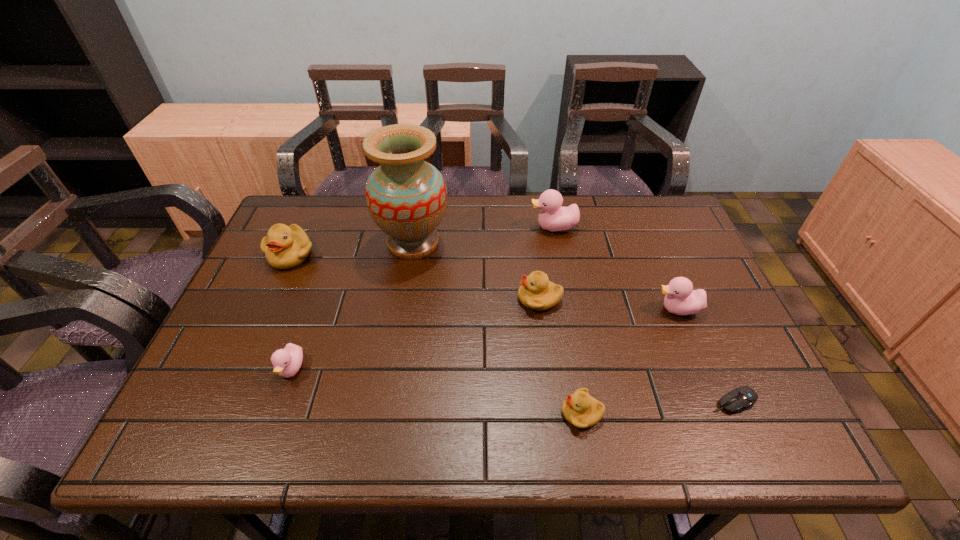
In the image, there is a desktop. At what (x,y) coordinates should I click in order to perform the action: click on vacant space at the left edge. Please return your answer as a coordinate pair (x, y). Looking at the image, I should click on (297, 303).

Locate an element on the screen. This screenshot has width=960, height=540. free location at the right edge is located at coordinates (714, 356).

This screenshot has height=540, width=960. In order to click on vacant area at the far left corner of the desktop in this screenshot , I will do `click(300, 213)`.

Where is `vacant position at the near left corner of the desktop`? The width and height of the screenshot is (960, 540). vacant position at the near left corner of the desktop is located at coordinates click(196, 436).

This screenshot has width=960, height=540. I want to click on free space between the nearest duckling and the second smallest yellow duckling, so click(x=561, y=356).

The image size is (960, 540). Identify the location of free area in between the computer mouse and the smallest pink duckling. tap(514, 386).

I want to click on vacant space that is in between the leftmost yellow duckling and the sixth object from right to left, so click(x=352, y=249).

Image resolution: width=960 pixels, height=540 pixels. What are the coordinates of `vacant space in between the tallest object and the nearest duckling` in the screenshot? It's located at (497, 328).

This screenshot has width=960, height=540. What are the coordinates of `free spot between the second farthest yellow duckling and the tallest object` in the screenshot? It's located at pyautogui.click(x=476, y=271).

The height and width of the screenshot is (540, 960). I want to click on free point between the computer mouse and the farthest yellow duckling, so click(x=513, y=328).